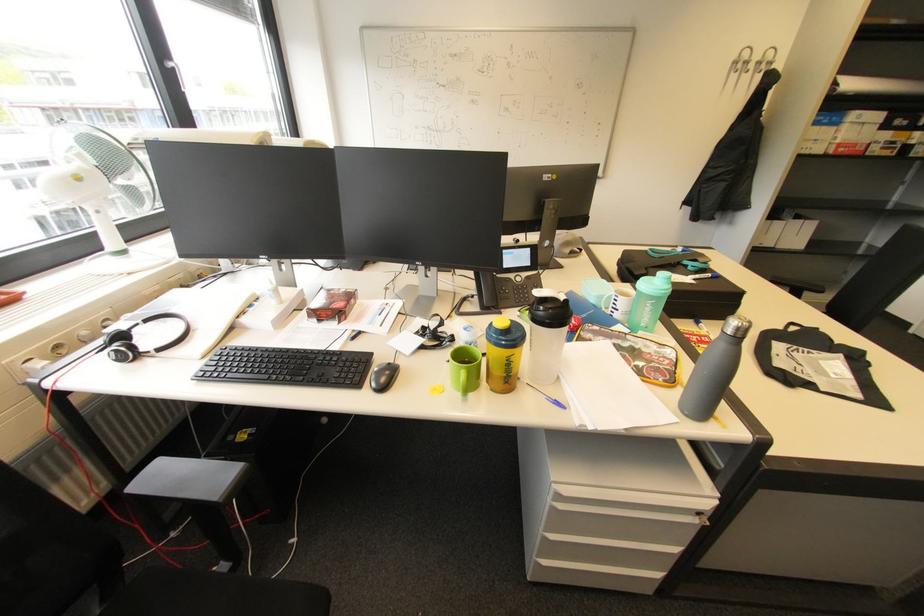
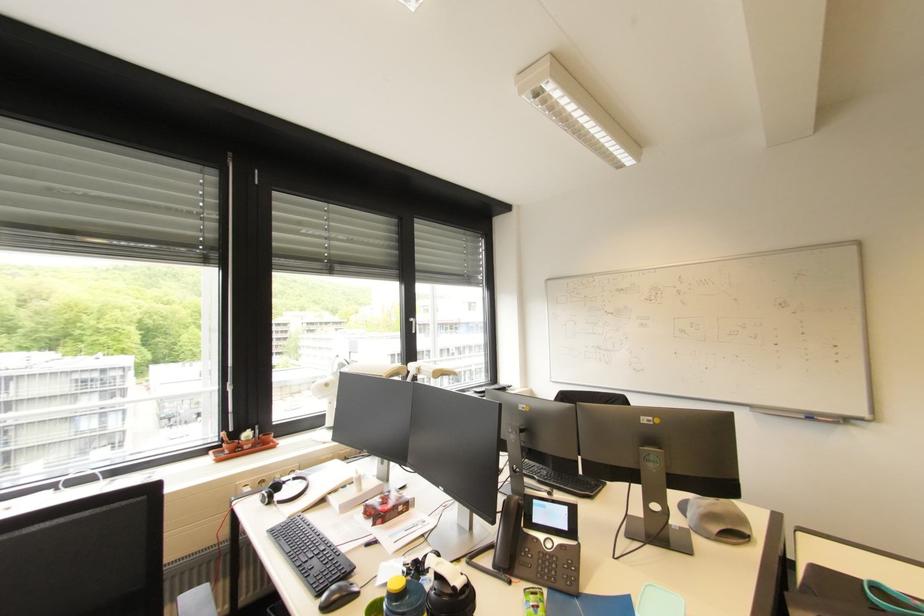
The point at [535,249] is marked in the first image. Where is the corresponding point in the second image?

(572, 509)